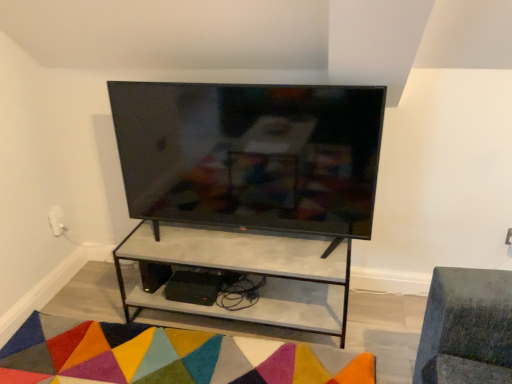
Question: Does matte concrete shelf at center turn towards matte black tv at center?

Choices:
 (A) no
 (B) yes

Answer: (A)

Question: Is matte concrete shelf at center next to matte black tv at center and touching it?

Choices:
 (A) yes
 (B) no

Answer: (B)

Question: From the image's perspective, is matte concrete shelf at center over matte black tv at center?

Choices:
 (A) no
 (B) yes

Answer: (A)

Question: Can you confirm if matte concrete shelf at center is smaller than matte black tv at center?

Choices:
 (A) yes
 (B) no

Answer: (B)

Question: Does matte concrete shelf at center have a greater height compared to matte black tv at center?

Choices:
 (A) no
 (B) yes

Answer: (A)

Question: In terms of size, does multicolored felt mat at lower center appear bigger or smaller than matte concrete shelf at center?

Choices:
 (A) small
 (B) big

Answer: (A)

Question: Is point (289, 357) closer or farther from the camera than point (304, 241)?

Choices:
 (A) closer
 (B) farther

Answer: (A)

Question: In terms of height, does multicolored felt mat at lower center look taller or shorter compared to matte concrete shelf at center?

Choices:
 (A) short
 (B) tall

Answer: (A)

Question: Considering the relative positions of multicolored felt mat at lower center and matte concrete shelf at center in the image provided, is multicolored felt mat at lower center to the left or to the right of matte concrete shelf at center?

Choices:
 (A) right
 (B) left

Answer: (B)

Question: Looking at the image, does matte concrete shelf at center seem bigger or smaller compared to multicolored felt mat at lower center?

Choices:
 (A) big
 (B) small

Answer: (A)

Question: From a real-world perspective, is matte concrete shelf at center positioned above or below multicolored felt mat at lower center?

Choices:
 (A) below
 (B) above

Answer: (B)

Question: Is matte concrete shelf at center taller or shorter than multicolored felt mat at lower center?

Choices:
 (A) tall
 (B) short

Answer: (A)

Question: Does point (278, 240) appear closer or farther from the camera than point (42, 342)?

Choices:
 (A) farther
 (B) closer

Answer: (B)

Question: Is matte black tv at center spatially inside matte concrete shelf at center, or outside of it?

Choices:
 (A) inside
 (B) outside

Answer: (B)

Question: From the image's perspective, is matte black tv at center positioned above or below matte concrete shelf at center?

Choices:
 (A) above
 (B) below

Answer: (A)